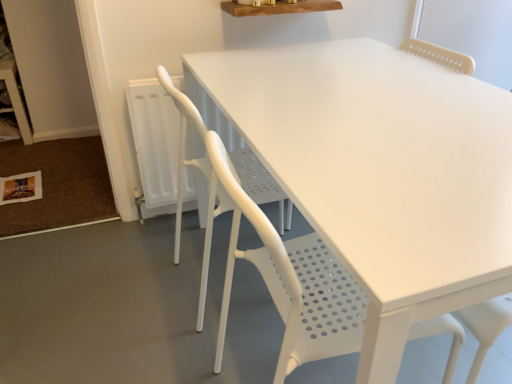
Where is `free region on the left part of white perforated chair at center, which is counted as the first chair, starting from the back`? This screenshot has width=512, height=384. free region on the left part of white perforated chair at center, which is counted as the first chair, starting from the back is located at coordinates (128, 286).